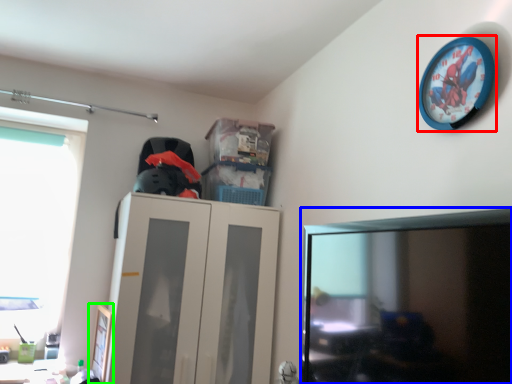
Question: Which is farther away from wall clock (highlighted by a red box)? computer monitor (highlighted by a blue box) or picture frame (highlighted by a green box)?

Choices:
 (A) computer monitor
 (B) picture frame

Answer: (B)